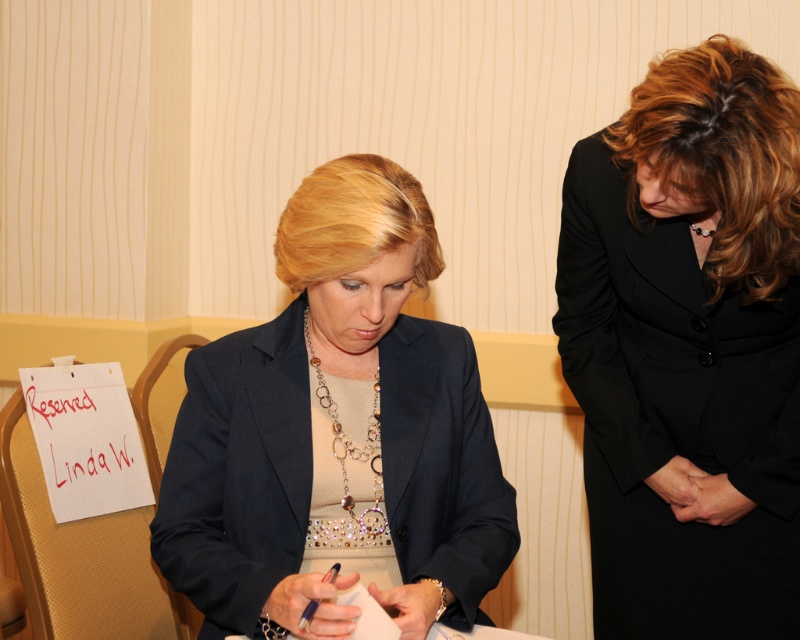
Question: Does black wool coat at center have a greater width compared to matte black blazer at center?

Choices:
 (A) no
 (B) yes

Answer: (A)

Question: Can you confirm if black wool coat at center is thinner than matte black blazer at center?

Choices:
 (A) yes
 (B) no

Answer: (A)

Question: Which point is closer to the camera taking this photo?

Choices:
 (A) (126, 476)
 (B) (428, 564)
 (C) (617, 476)

Answer: (B)

Question: Is matte black blazer at center below red handwritten text at center?

Choices:
 (A) yes
 (B) no

Answer: (B)

Question: Which of the following is the farthest from the observer?

Choices:
 (A) (220, 433)
 (B) (568, 332)

Answer: (B)

Question: Which of these objects is positioned farthest from the matte black blazer at center?

Choices:
 (A) black wool coat at center
 (B) red handwritten text at center

Answer: (B)